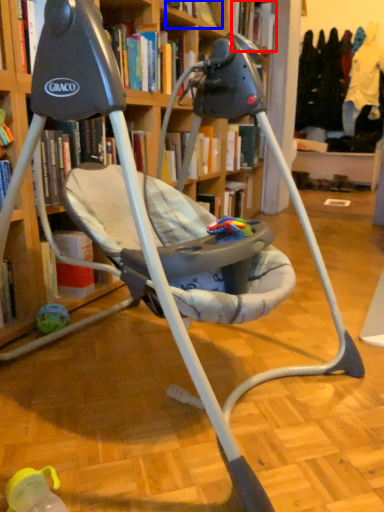
Question: Which object is further to the camera taking this photo, book (highlighted by a red box) or book (highlighted by a blue box)?

Choices:
 (A) book
 (B) book

Answer: (A)